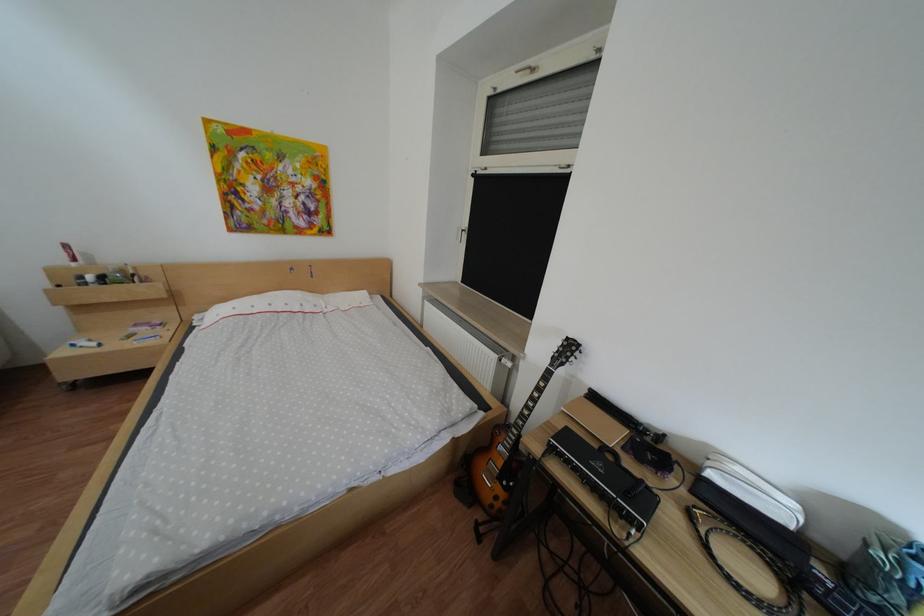
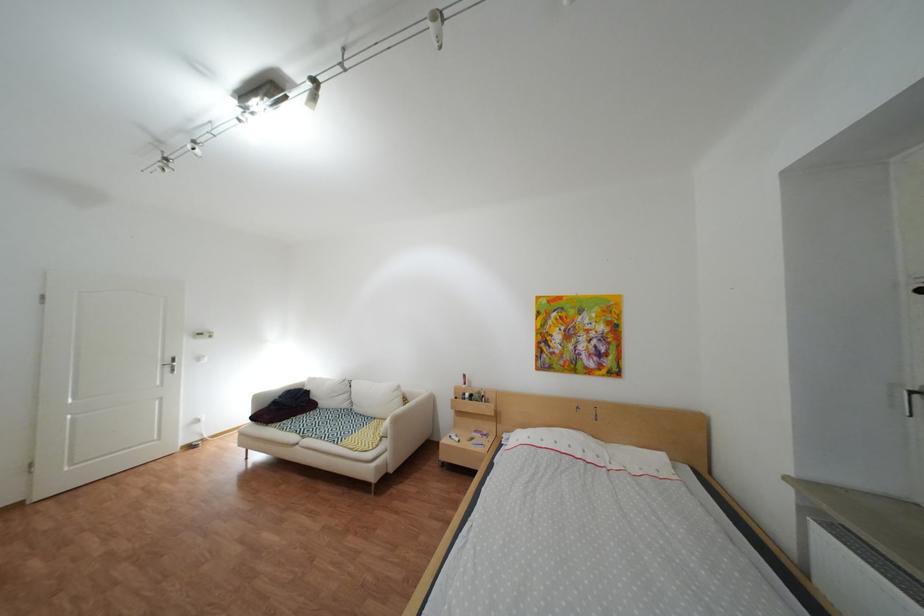
How did the camera likely rotate?

The rotation direction of the camera is left-up.